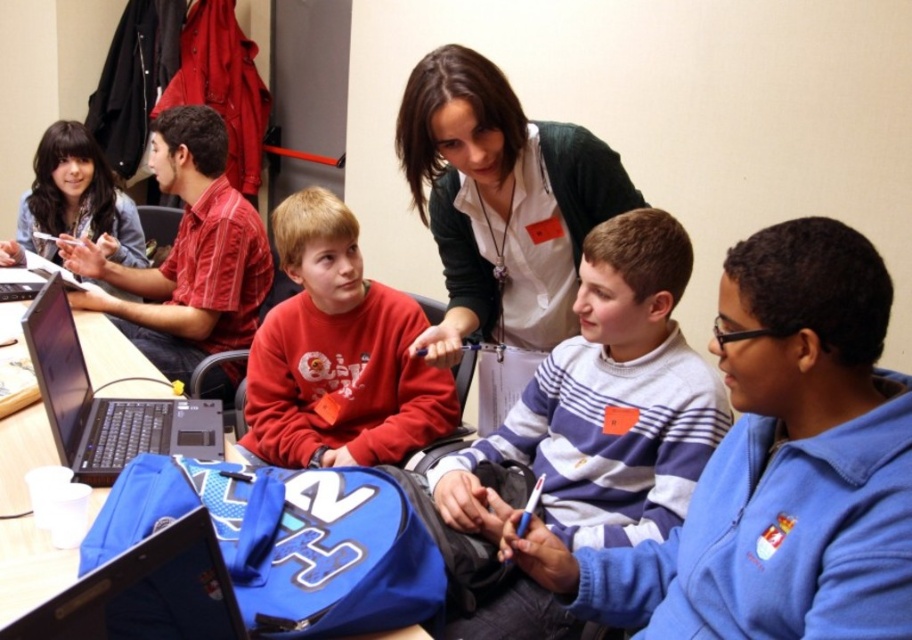
Is striped cotton sweater at center further to the viewer compared to matte red sweatshirt at center?

No, striped cotton sweater at center is in front of matte red sweatshirt at center.

Describe the element at coordinates (606, 403) in the screenshot. I see `striped cotton sweater at center` at that location.

Is point (541, 456) closer to camera compared to point (320, 236)?

Yes, it is in front of point (320, 236).

Identify the location of striped cotton sweater at center. The image size is (912, 640). (606, 403).

Is white shirt at center further to the viewer compared to shiny black laptop at lower left?

That is True.

What do you see at coordinates (501, 212) in the screenshot? The image size is (912, 640). I see `white shirt at center` at bounding box center [501, 212].

The image size is (912, 640). Find the location of `white shirt at center`. white shirt at center is located at coordinates (501, 212).

The image size is (912, 640). In order to click on white shirt at center in this screenshot , I will do `click(501, 212)`.

Who is positioned more to the left, blue fleece jacket at right or striped cotton sweater at center?

striped cotton sweater at center is more to the left.

Measure the distance between blue fleece jacket at right and camera.

blue fleece jacket at right is 31.34 inches from camera.

Identify the location of blue fleece jacket at right. The height and width of the screenshot is (640, 912). (776, 467).